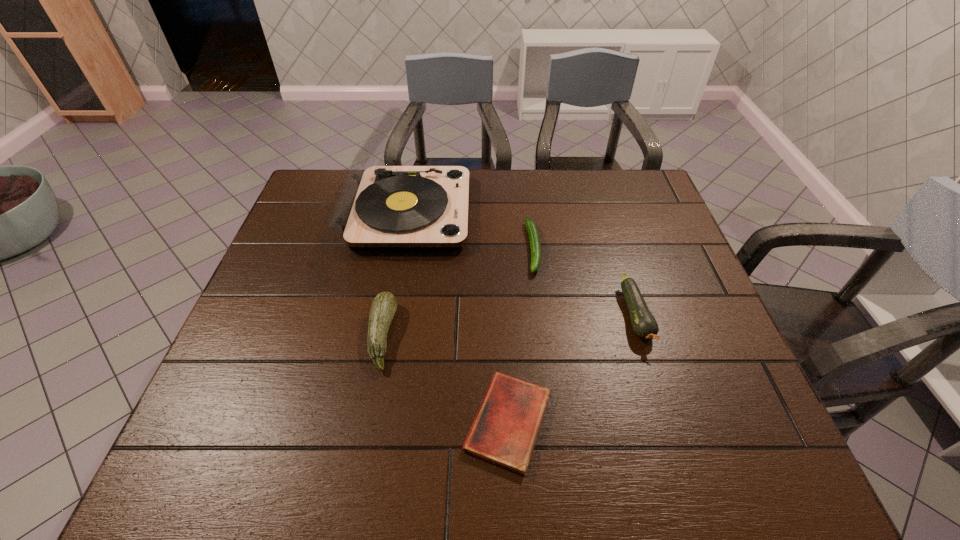
In order to click on unoccupied area between the nearest object and the fourth tallest object in this screenshot , I will do `click(521, 335)`.

Where is `vacant point located between the shortest zucchini and the rightmost zucchini`? Image resolution: width=960 pixels, height=540 pixels. vacant point located between the shortest zucchini and the rightmost zucchini is located at coordinates (585, 282).

At what (x,y) coordinates should I click in order to perform the action: click on vacant point located between the leftmost zucchini and the rightmost object. Please return your answer as a coordinate pair (x, y). The image size is (960, 540). Looking at the image, I should click on (509, 326).

This screenshot has height=540, width=960. I want to click on the third closest object to the farthest zucchini, so click(x=504, y=432).

You are a GUI agent. You are given a task and a screenshot of the screen. Output one action in this format:
    pyautogui.click(x=<x>, y=<y>)
    Task: Click on the object that ranks as the second closest to the farthest zucchini
    The height and width of the screenshot is (540, 960).
    Given the screenshot: What is the action you would take?
    pyautogui.click(x=644, y=325)

The image size is (960, 540). Identify the location of zucchini that is the nearest to the rightmost object. (535, 245).

Identify which zucchini is the second closest to the leftmost zucchini. Please provide its 2D coordinates. Your answer should be formatted as a tuple, i.e. [(x, y)], where the tuple contains the x and y coordinates of a point satisfying the conditions above.

[(644, 325)]

At what (x,y) coordinates should I click in order to perform the action: click on vacant space that satisfies the following two spatial constraints: 1. at the stem end of the leftmost zucchini; 2. on the left side of the nearest object. Please return your answer as a coordinate pair (x, y). Looking at the image, I should click on (366, 422).

This screenshot has width=960, height=540. Identify the location of vacant space that satisfies the following two spatial constraints: 1. at the stem end of the leftmost zucchini; 2. on the right side of the diary. (366, 422).

Identify the location of vacant space that satisfies the following two spatial constraints: 1. at the blossom end of the rightmost zucchini; 2. at the stem end of the leftmost zucchini. This screenshot has width=960, height=540. (642, 336).